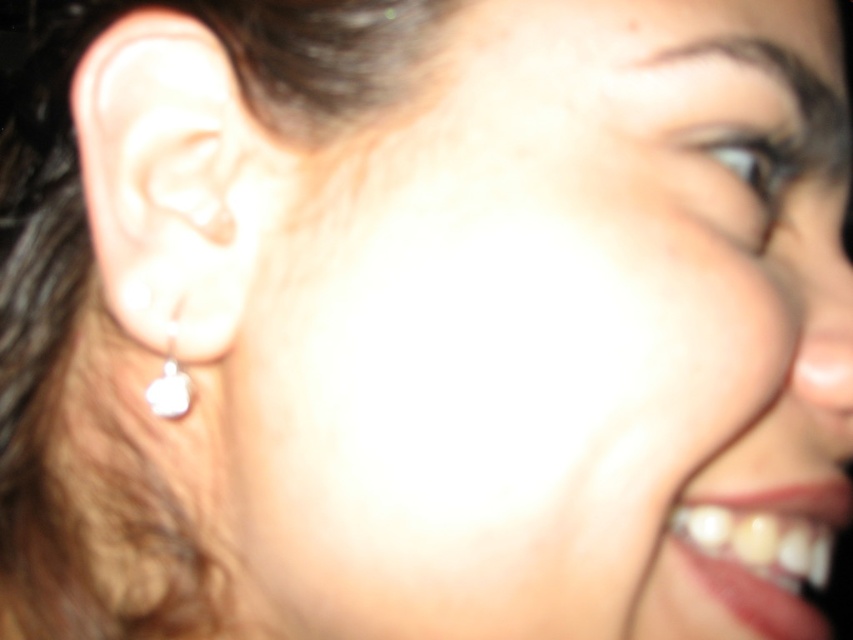
You are a jeweler examining two earrings on a customer. The customer has a pearl earring at left and a silver metallic earring at left. Which earring has a larger width?

The pearl earring at left is wider than the silver metallic earring at left according to the description.

You are a photographer adjusting lighting for a portrait. You notice the pearl earring at left and the bright spot on the cheek. How far apart are these two features?

The pearl earring at left and the bright spot on the cheek are 10.26 inches apart.

You are a photographer trying to focus on two points in the image. The first point is at coordinate point (x=125, y=184) and the second is at point (x=173, y=308). Which point is closer to you?

Point (x=125, y=184) is closer to you than point (x=173, y=308) because it is further to the viewer.